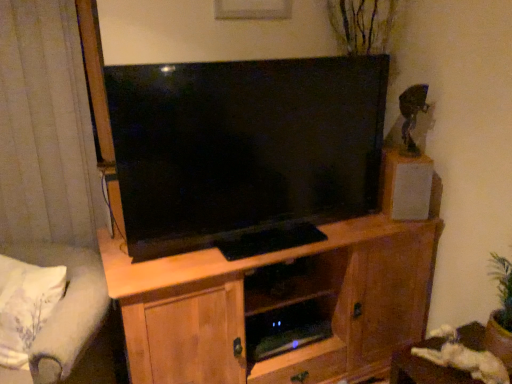
Question: Considering the positions of wooden table at lower right and gray fabric curtain at left in the image, is wooden table at lower right bigger or smaller than gray fabric curtain at left?

Choices:
 (A) big
 (B) small

Answer: (B)

Question: From the image's perspective, is wooden table at lower right above or below gray fabric curtain at left?

Choices:
 (A) above
 (B) below

Answer: (B)

Question: Based on their relative distances, which object is nearer to the gray fabric curtain at left?

Choices:
 (A) white matte speaker at upper right
 (B) light gray fabric studio couch at lower left
 (C) light brown wood cabinet at center
 (D) wooden table at lower right

Answer: (B)

Question: Estimate the real-world distances between objects in this image. Which object is closer to the wooden table at lower right?

Choices:
 (A) light brown wood cabinet at center
 (B) gray fabric curtain at left
 (C) light gray fabric studio couch at lower left
 (D) white matte speaker at upper right

Answer: (A)